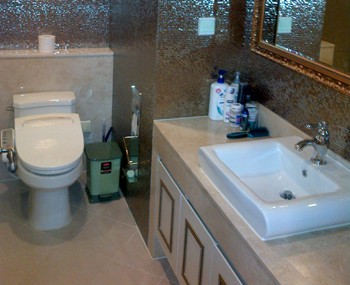
Find the location of a particular element. The image size is (350, 285). knob is located at coordinates (308, 128).